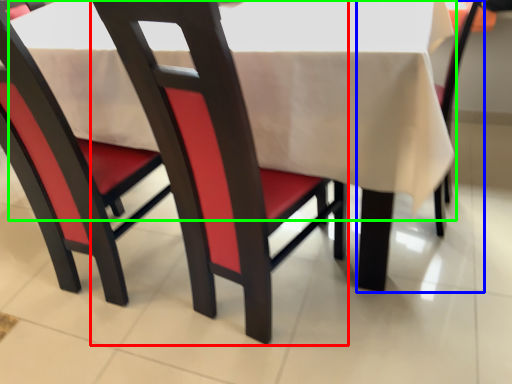
Question: Based on their relative distances, which object is farther from chair (highlighted by a red box)? Choose from chair (highlighted by a blue box) and tablecloth (highlighted by a green box).

Choices:
 (A) chair
 (B) tablecloth

Answer: (A)